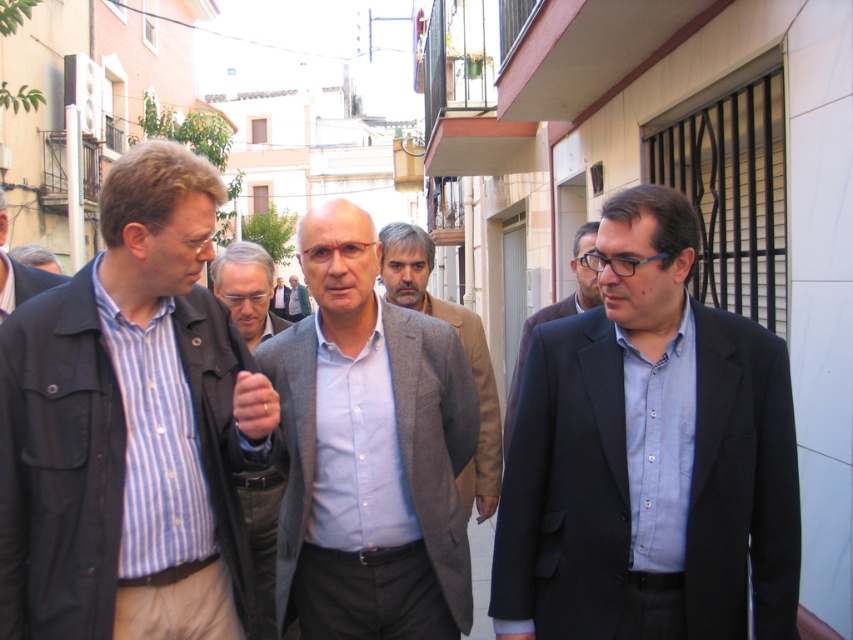
Does light brown woolen jacket at center have a lesser width compared to dark blue suit at center?

In fact, light brown woolen jacket at center might be wider than dark blue suit at center.

Looking at this image, does light brown woolen jacket at center have a larger size compared to dark blue suit at center?

Yes.

Is point (392, 243) closer to viewer compared to point (595, 272)?

No, (392, 243) is behind (595, 272).

Identify the location of light brown woolen jacket at center. The height and width of the screenshot is (640, 853). (462, 344).

Is point (534, 573) positioned after point (253, 516)?

No, it is in front of (253, 516).

Is point (643, 634) behind point (262, 476)?

No, it is in front of (262, 476).

At what (x,y) coordinates should I click in order to perform the action: click on matte black suit at right. Please return your answer as a coordinate pair (x, y). The image size is (853, 640). Looking at the image, I should click on (648, 456).

Does light gray wool coat at center have a lesser width compared to light blue shirt at center?

Yes.

Between point (241, 280) and point (300, 304), which one is positioned behind?

The point (300, 304) is more distant.

What are the coordinates of `light gray wool coat at center` in the screenshot? It's located at (247, 289).